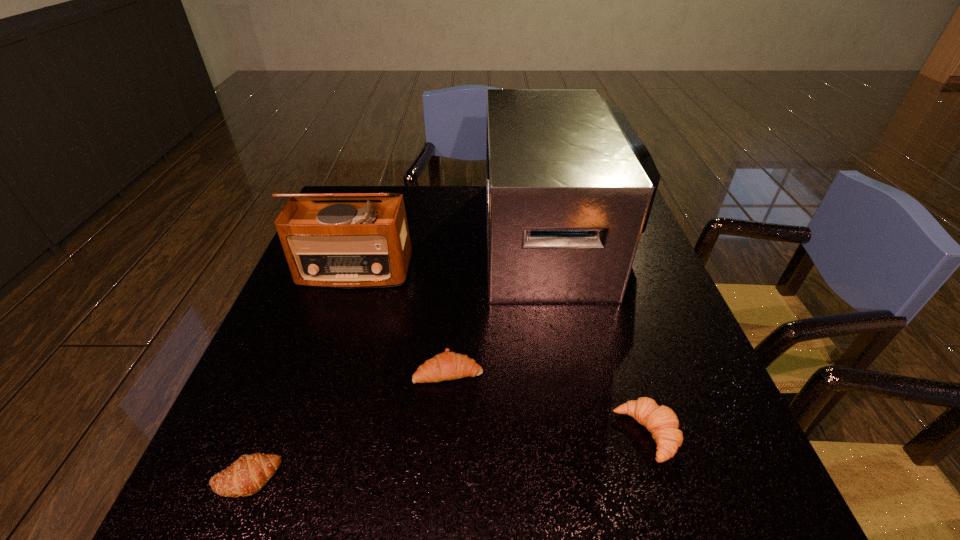
The height and width of the screenshot is (540, 960). Find the location of `vacant space located on the left of the rightmost crescent roll`. vacant space located on the left of the rightmost crescent roll is located at coordinates (484, 434).

You are a GUI agent. You are given a task and a screenshot of the screen. Output one action in this format:
    pyautogui.click(x=<x>, y=<y>)
    Task: Click on the vacant area situated on the right of the leftmost crescent roll
    This screenshot has height=540, width=960.
    Given the screenshot: What is the action you would take?
    pyautogui.click(x=386, y=478)

This screenshot has height=540, width=960. Find the location of `vacant space situated on the right of the third nearest object`. vacant space situated on the right of the third nearest object is located at coordinates (590, 370).

Image resolution: width=960 pixels, height=540 pixels. Find the location of `object that is at the far edge`. object that is at the far edge is located at coordinates (570, 186).

I want to click on radio receiver that is positioned at the left edge, so [x=350, y=244].

This screenshot has height=540, width=960. Find the location of `crescent roll located at the left edge`. crescent roll located at the left edge is located at coordinates (246, 476).

Locate an element on the screen. microwave oven situated at the right edge is located at coordinates (570, 186).

This screenshot has height=540, width=960. Identify the location of crescent roll that is at the right edge. (661, 421).

Identify the location of object situated at the near left corner. (246, 476).

At what (x,y) coordinates should I click in order to perform the action: click on object located in the far right corner section of the desktop. Please return your answer as a coordinate pair (x, y). This screenshot has height=540, width=960. Looking at the image, I should click on (570, 186).